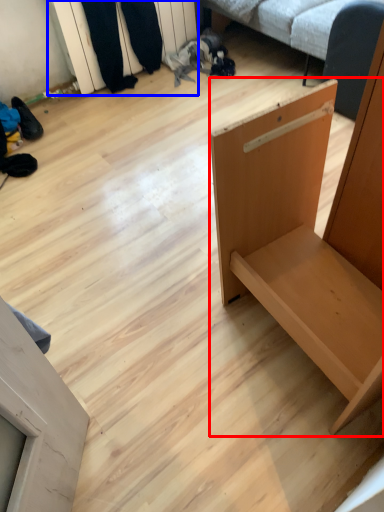
Question: Which point is closer to the camera, furniture (highlighted by a red box) or shelf (highlighted by a blue box)?

Choices:
 (A) furniture
 (B) shelf

Answer: (A)